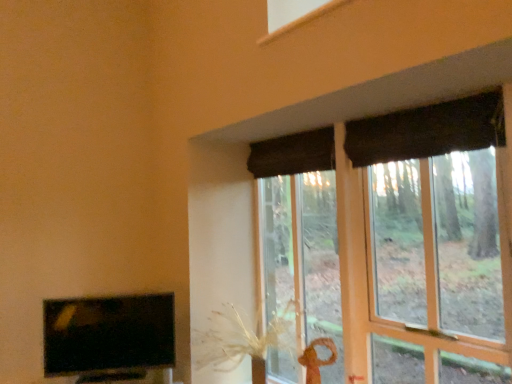
Question: Looking at their shapes, would you say dark fabric curtain at upper center, the 2th curtain when ordered from front to back, is wider or thinner than matte black tv at lower left?

Choices:
 (A) wide
 (B) thin

Answer: (A)

Question: From the image's perspective, is dark fabric curtain at upper center, the first curtain in the left-to-right sequence, above or below matte black tv at lower left?

Choices:
 (A) below
 (B) above

Answer: (B)

Question: Estimate the real-world distances between objects in this image. Which object is farther from the matte black tv at lower left?

Choices:
 (A) dark fabric curtain at upper center, the 2th curtain when ordered from front to back
 (B) dark fabric curtain at upper right, placed as the 2th curtain when sorted from back to front
 (C) matte brown curtain at upper right

Answer: (C)

Question: Which of these objects is positioned farthest from the matte brown curtain at upper right?

Choices:
 (A) matte black tv at lower left
 (B) dark fabric curtain at upper center, the 2th curtain when ordered from front to back
 (C) dark fabric curtain at upper right, acting as the 1th curtain starting from the right

Answer: (A)